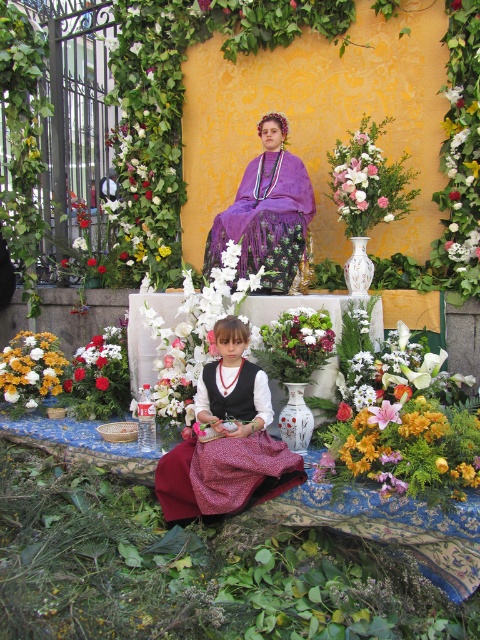
Question: Which object is positioned closest to the white glossy vase at center?

Choices:
 (A) purple satin dress at center
 (B) matte yellow flowers at lower left

Answer: (A)

Question: Is white glossy vase at center closer to the viewer compared to white glossy vase at upper center?

Choices:
 (A) no
 (B) yes

Answer: (B)

Question: Does polka dot fabric dress at lower center lie behind matte yellow flowers at lower left?

Choices:
 (A) yes
 (B) no

Answer: (B)

Question: Which point is closer to the camera taking this photo?

Choices:
 (A) (255, 280)
 (B) (285, 220)

Answer: (A)

Question: Does white glossy vase at center have a lesser width compared to white glossy vase at upper center?

Choices:
 (A) yes
 (B) no

Answer: (B)

Question: Which object is the farthest from the purple satin dress at center?

Choices:
 (A) white glossy vase at center
 (B) white glossy vase at upper center

Answer: (A)